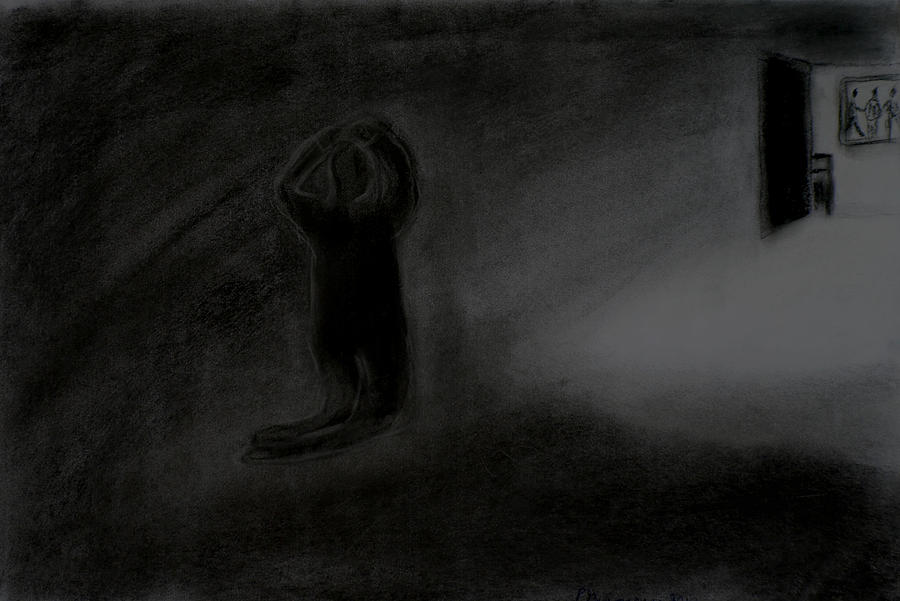
This screenshot has width=900, height=601. Identify the location of picture of a black and white charcoal drawing. (10, 11).